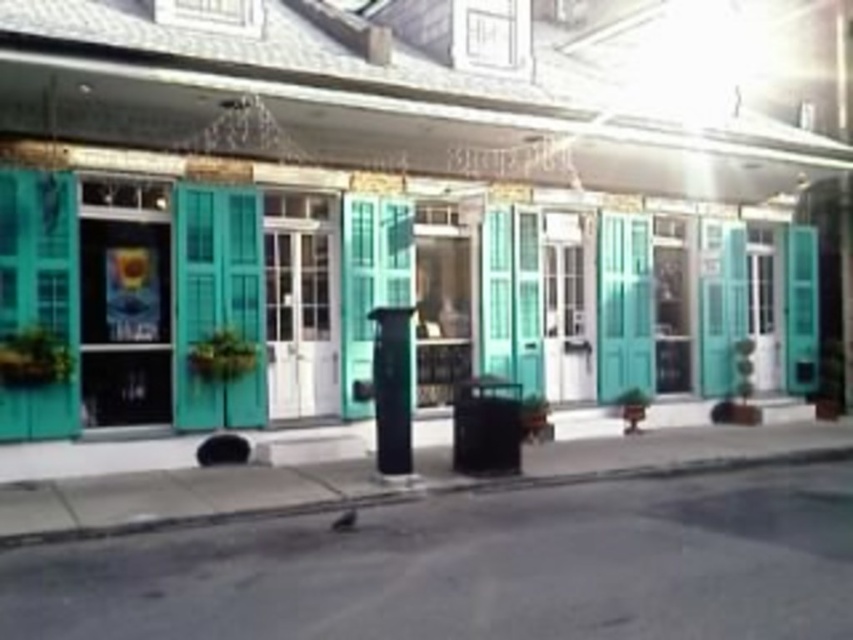
Does point (805, 376) come in front of point (695, 468)?

That is False.

Is teal matte shutters at center bigger than concrete at lower left?

Yes.

Find the location of `teal matte shutters at center`. teal matte shutters at center is located at coordinates (410, 195).

The width and height of the screenshot is (853, 640). In order to click on teal matte shutters at center in this screenshot , I will do `click(410, 195)`.